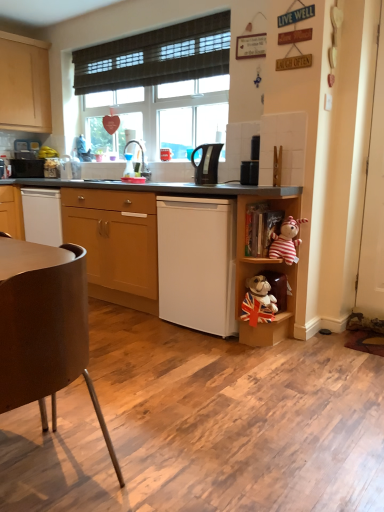
Where is `free space that is to the left of white matte dishwasher at center`? Image resolution: width=384 pixels, height=512 pixels. free space that is to the left of white matte dishwasher at center is located at coordinates (138, 327).